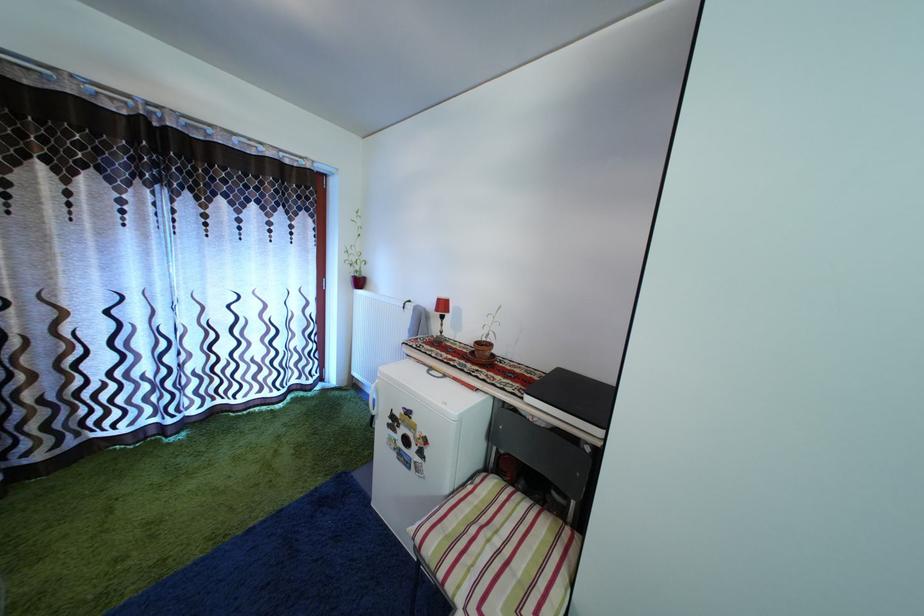
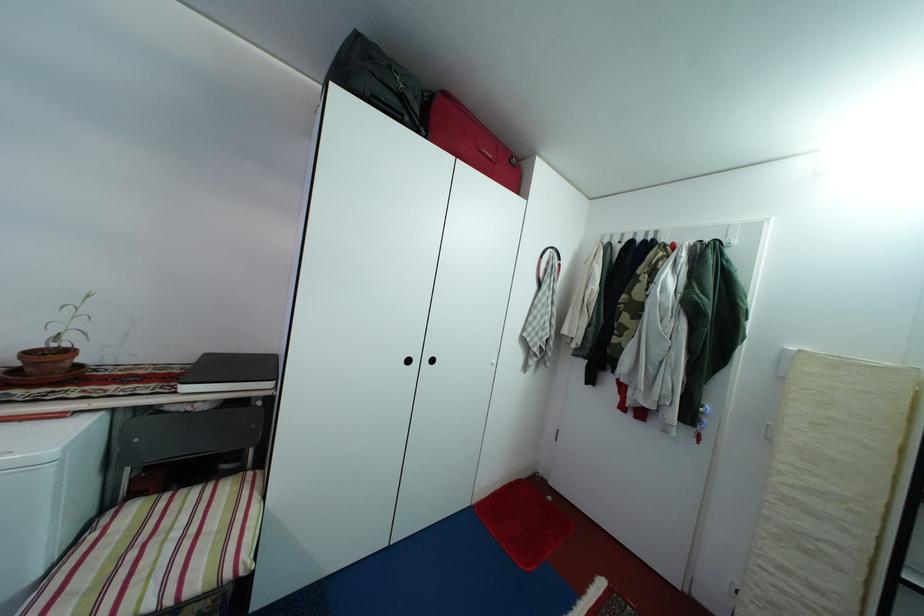
Where in the second image is the point corresponding to pixel 456 499 from the first image?

(47, 581)